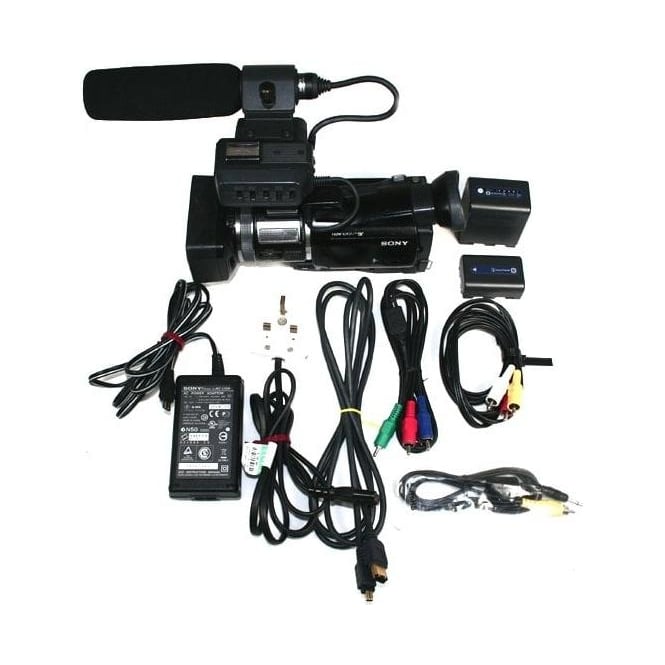
Locate an element on the screen. red zip ties around the cords toward the left is located at coordinates (179, 340), (284, 437).